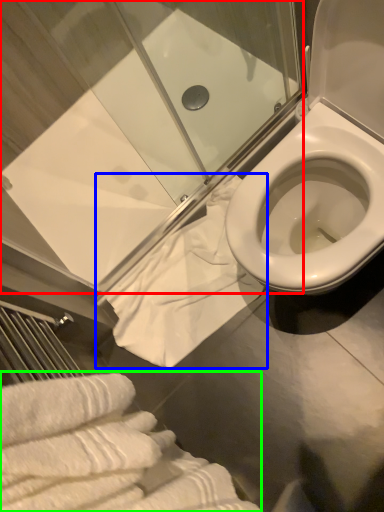
Question: Which object is the closest to the shower door (highlighted by a red box)? Choose among these: bath towel (highlighted by a blue box) or bath towel (highlighted by a green box).

Choices:
 (A) bath towel
 (B) bath towel

Answer: (A)